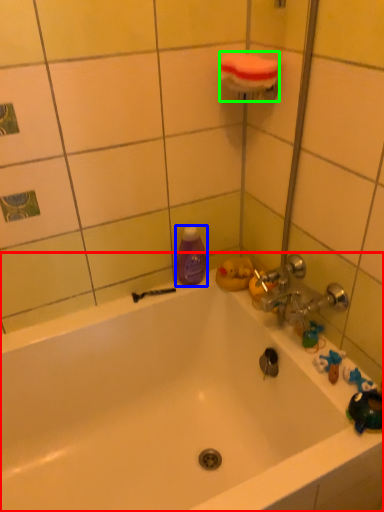
Question: Which object is the closest to the bathtub (highlighted by a red box)? Choose among these: cleaning product (highlighted by a blue box) or towel bar (highlighted by a green box).

Choices:
 (A) cleaning product
 (B) towel bar

Answer: (A)